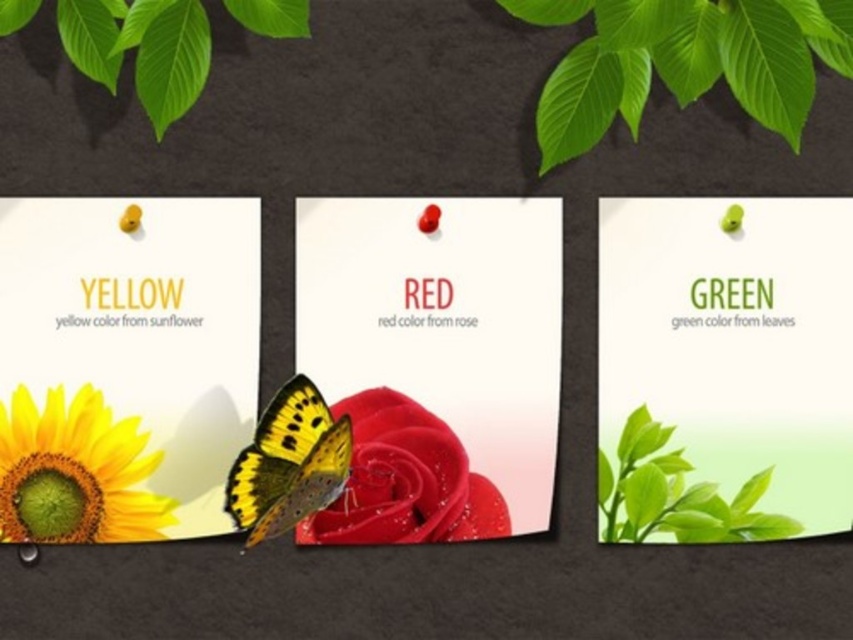
Is matte yellow sunflower at left smaller than matte red rose at center?

No.

Does matte yellow sunflower at left appear on the right side of matte red rose at center?

Incorrect, matte yellow sunflower at left is not on the right side of matte red rose at center.

Image resolution: width=853 pixels, height=640 pixels. What are the coordinates of `matte yellow sunflower at left` in the screenshot? It's located at [125, 364].

Does matte red rose at center lie behind yellow matte butterfly at center?

Yes, matte red rose at center is further from the viewer.

Between matte red rose at center and yellow matte butterfly at center, which one appears on the right side from the viewer's perspective?

matte red rose at center

Which is behind, point (376, 401) or point (256, 531)?

Positioned behind is point (376, 401).

Where is `matte red rose at center`? matte red rose at center is located at coordinates (405, 481).

Does matte yellow sunflower at lower left appear under yellow matte butterfly at center?

Yes, matte yellow sunflower at lower left is below yellow matte butterfly at center.

How distant is matte yellow sunflower at lower left from yellow matte butterfly at center?

matte yellow sunflower at lower left is 3.15 inches away from yellow matte butterfly at center.

What do you see at coordinates (74, 472) in the screenshot? I see `matte yellow sunflower at lower left` at bounding box center [74, 472].

Where is `matte yellow sunflower at lower left`? This screenshot has width=853, height=640. matte yellow sunflower at lower left is located at coordinates (74, 472).